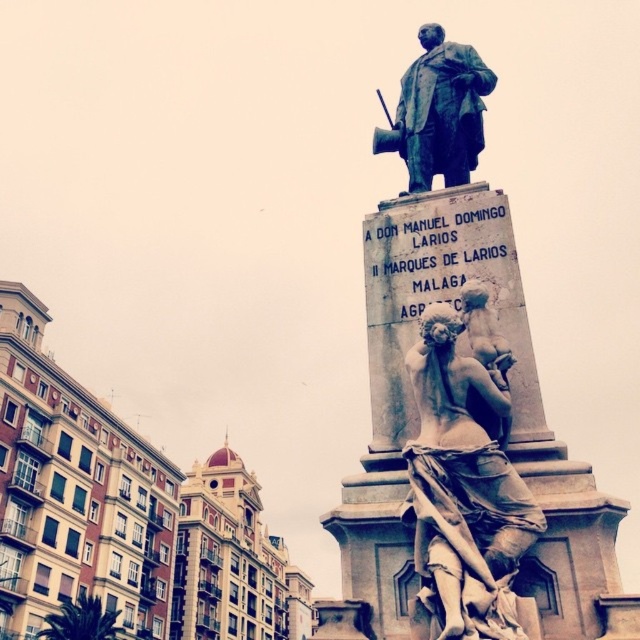
Does bronze statue at center have a greater width compared to matte stone sculpture at center?

Correct, the width of bronze statue at center exceeds that of matte stone sculpture at center.

Can you confirm if bronze statue at center is bigger than matte stone sculpture at center?

Correct, bronze statue at center is larger in size than matte stone sculpture at center.

Between point (460, 243) and point (470, 627), which one is positioned in front?

Point (470, 627) is in front.

At what (x,y) coordinates should I click in order to perform the action: click on bronze statue at center. Please return your answer as a coordinate pair (x, y). Image resolution: width=640 pixels, height=640 pixels. Looking at the image, I should click on (417, 426).

Does bronze statue at center appear on the right side of green bronze statue at center?

In fact, bronze statue at center is to the left of green bronze statue at center.

What do you see at coordinates (417, 426) in the screenshot? The image size is (640, 640). I see `bronze statue at center` at bounding box center [417, 426].

The width and height of the screenshot is (640, 640). Describe the element at coordinates (417, 426) in the screenshot. I see `bronze statue at center` at that location.

Identify the location of bronze statue at center. Image resolution: width=640 pixels, height=640 pixels. (417, 426).

Is matte stone sculpture at center to the left of green bronze statue at center from the viewer's perspective?

Correct, you'll find matte stone sculpture at center to the left of green bronze statue at center.

What are the coordinates of `matte stone sculpture at center` in the screenshot? It's located at (464, 490).